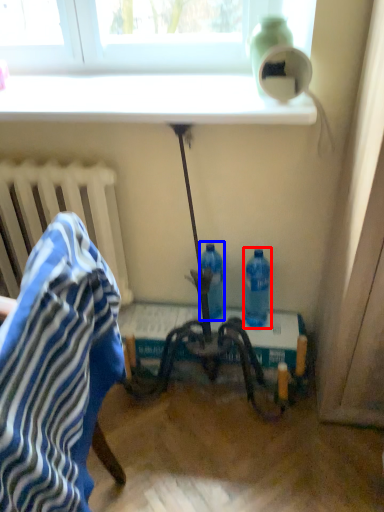
Question: Which object appears farthest to the camera in this image, bottle (highlighted by a red box) or bottle (highlighted by a blue box)?

Choices:
 (A) bottle
 (B) bottle

Answer: (B)